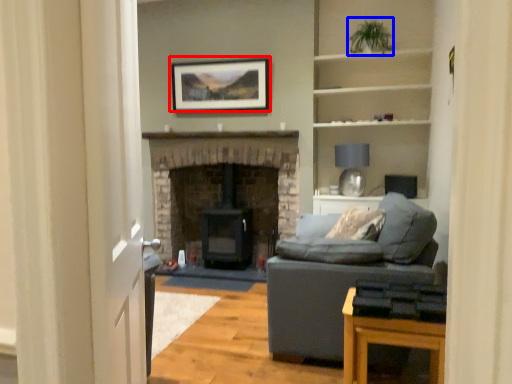
Question: Which object appears farthest to the camera in this image, picture frame (highlighted by a red box) or plant (highlighted by a blue box)?

Choices:
 (A) picture frame
 (B) plant

Answer: (A)